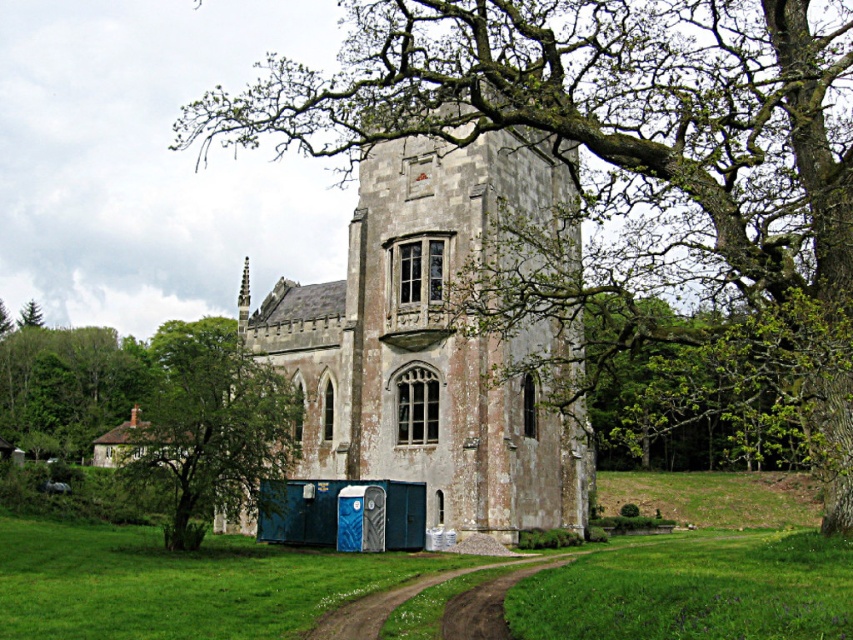
You are planning to place a new garden statue that is 2 meters tall in the scene. Considering the scale of the stone church at center and the green grassy at lower left, where would be the most appropriate location for the statue to maintain visual harmony?

The stone church at center is larger in size compared to the green grassy at lower left. To maintain visual harmony, the garden statue should be placed near the green grassy at lower left since the statue is smaller than the church and the grassy area is a more modest scale.

You are a hiker who wants to take a photo of the historic stone building. You need to position yourself so that the smooth bark tree at center and the green grassy field at lower right are both visible in the frame. Based on their positions, which side of the building should you stand on to include both objects in your photo?

You should stand on the right side of the historic stone building. Since the smooth bark tree at center is to the left of the green grassy field at lower right, positioning yourself on the right side will allow both the tree and the field to be captured in the photo frame.